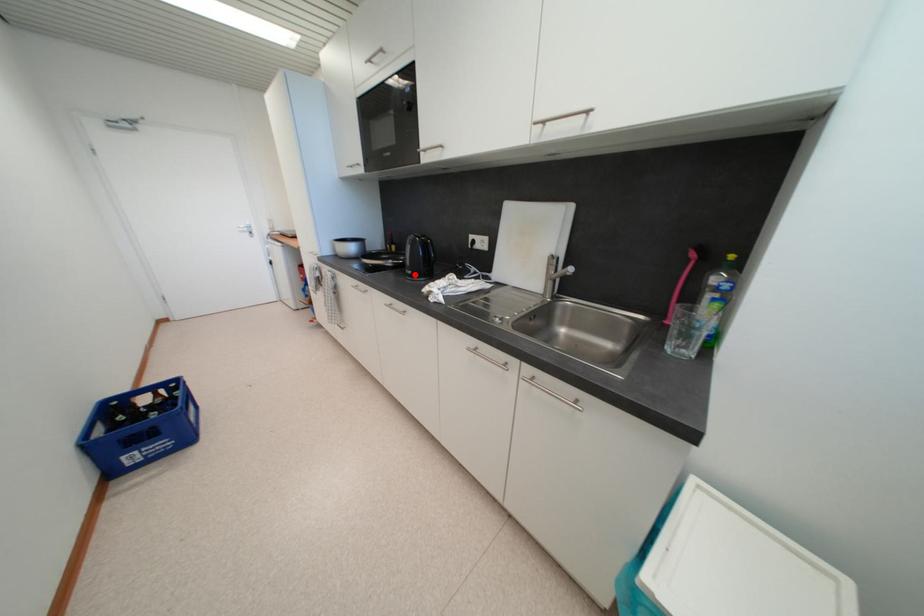
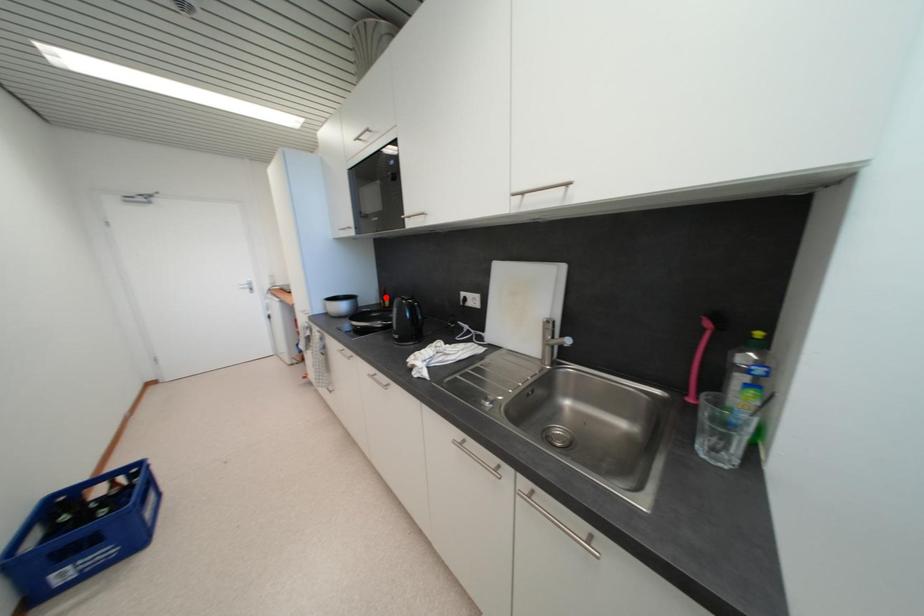
I am providing you with two images of the same scene from different viewpoints. A red point is marked on the first image and another point is marked on the second image. Are the points marked in image1 and image2 representing the same 3D position?

No